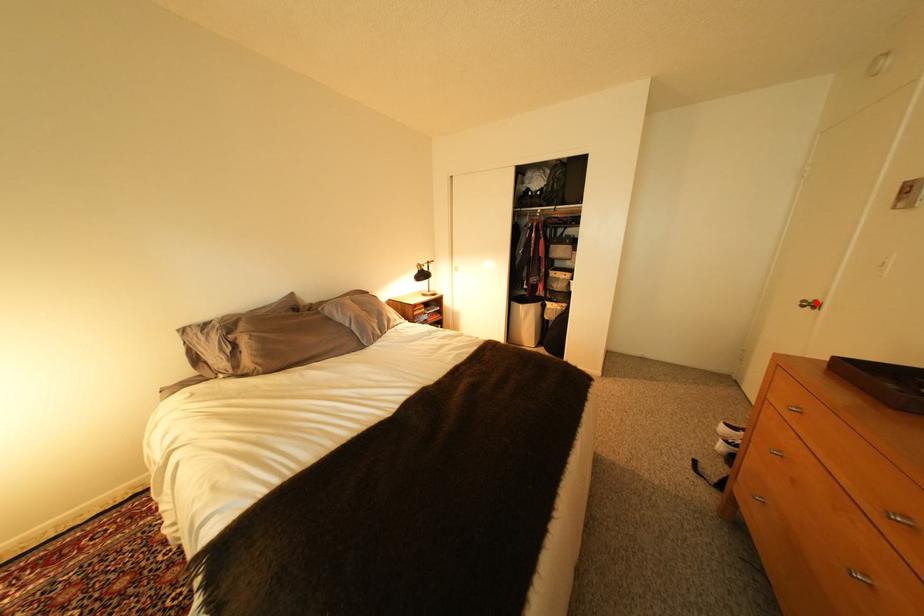
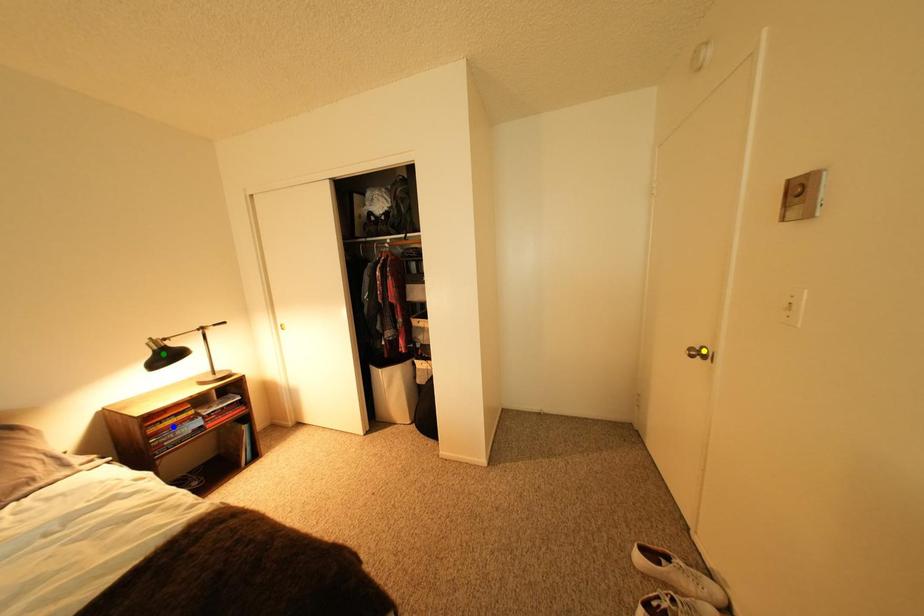
Question: I am providing you with two images of the same scene from different viewpoints. A red point is marked on the first image. You are given multiple points on the second image. In image 2, which mark is for the same physical point as the one in image 1?

Choices:
 (A) blue point
 (B) yellow point
 (C) green point

Answer: (B)